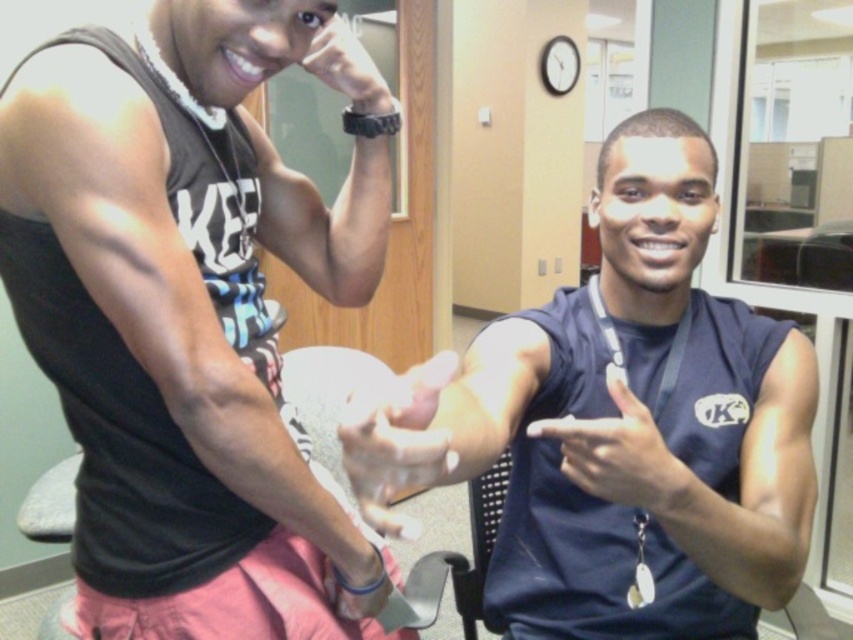
Is smooth skin hand at center taller than matte black hand at center?

Correct, smooth skin hand at center is much taller as matte black hand at center.

Which is above, smooth skin hand at center or matte black hand at center?

matte black hand at center

Who is more forward, (351, 406) or (602, 458)?

Positioned in front is point (351, 406).

Where is `smooth skin hand at center`? The height and width of the screenshot is (640, 853). smooth skin hand at center is located at coordinates (397, 442).

Can you confirm if black matte tank top at left is wider than matte black hand at center?

Yes, black matte tank top at left is wider than matte black hand at center.

Is black matte tank top at left bigger than matte black hand at center?

Indeed, black matte tank top at left has a larger size compared to matte black hand at center.

Between point (387, 211) and point (585, 435), which one is positioned in front?

Point (585, 435) is in front.

Image resolution: width=853 pixels, height=640 pixels. I want to click on black matte tank top at left, so click(x=186, y=321).

Does black matte tank top at left have a greater height compared to navy blue sleeveless shirt at center?

Indeed, black matte tank top at left has a greater height compared to navy blue sleeveless shirt at center.

Who is more distant from viewer, [77,182] or [468,358]?

Point [468,358]

The width and height of the screenshot is (853, 640). Find the location of `black matte tank top at left`. black matte tank top at left is located at coordinates (186, 321).